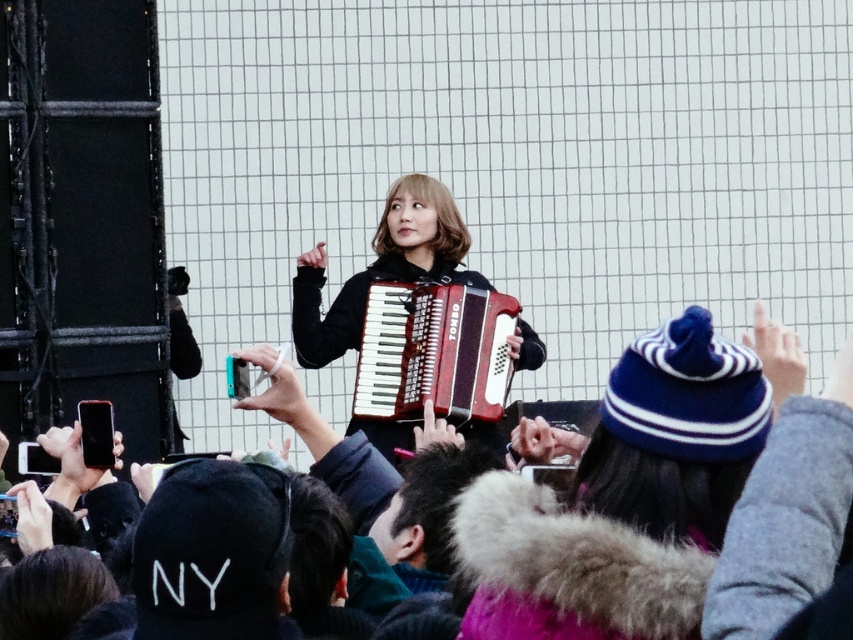
Looking at this image, you are a photographer trying to capture the performer wearing the velvet blue beanie at center and the matte red wood accordion at center. Which object will appear closer to the camera in your photo?

The velvet blue beanie at center will appear closer to the camera in the photo because it is positioned in front of the matte red wood accordion at center.

You are a photographer at the concert and want to take a closeup shot of the performer. The velvet blue beanie at center and the matte black accordion at center are both in focus. Which object appears thinner in the photo?

The velvet blue beanie at center appears thinner than the matte black accordion at center in the photo.

You are standing at the point labeled point (x=426, y=220) and want to move to the performer in the center. Is the point labeled point (x=587, y=509) blocking your path?

Point (x=587, y=509) is in front of point (x=426, y=220), so yes, the point labeled point (x=587, y=509) is blocking your path to the performer in the center.